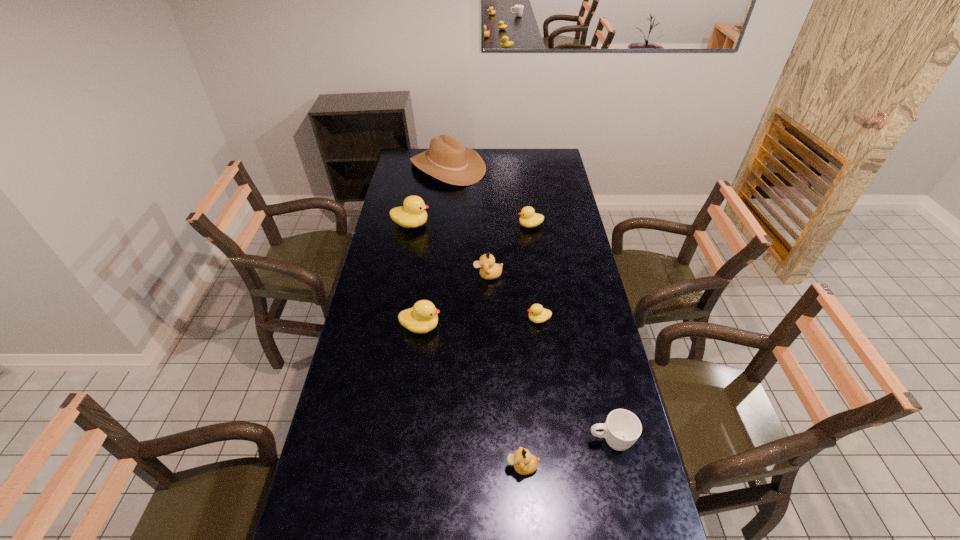
This screenshot has width=960, height=540. Identify the location of vacant area between the rightmost object and the tallest duckling. 511,333.

Identify the location of empty space that is in between the tallest duckling and the shortest duckling. (475, 272).

At what (x,y) coordinates should I click in order to perform the action: click on free space between the bigger tan duckling and the cup. Please return your answer as a coordinate pair (x, y). Looking at the image, I should click on (549, 358).

Locate an element on the screen. This screenshot has height=540, width=960. free space that is in between the smaller tan duckling and the shortest object is located at coordinates (531, 393).

Find the location of `free space between the shortest object and the tallest duckling`. free space between the shortest object and the tallest duckling is located at coordinates (x=475, y=272).

Where is `free space between the cowboy hat and the shortest duckling`? The width and height of the screenshot is (960, 540). free space between the cowboy hat and the shortest duckling is located at coordinates (493, 244).

Where is `object identified as the closest to the nearest duckling`? object identified as the closest to the nearest duckling is located at coordinates (622, 428).

Where is `object that is the closest to the shortest object`? The image size is (960, 540). object that is the closest to the shortest object is located at coordinates (489, 270).

At what (x,y) coordinates should I click in order to perform the action: click on duckling object that ranks as the fifth closest to the second biggest yellow duckling. Please return your answer as a coordinate pair (x, y). The height and width of the screenshot is (540, 960). Looking at the image, I should click on (530, 219).

Point out which duckling is positioned as the fourth nearest to the nearest duckling. Please provide its 2D coordinates. Your answer should be formatted as a tuple, i.e. [(x, y)], where the tuple contains the x and y coordinates of a point satisfying the conditions above.

[(530, 219)]